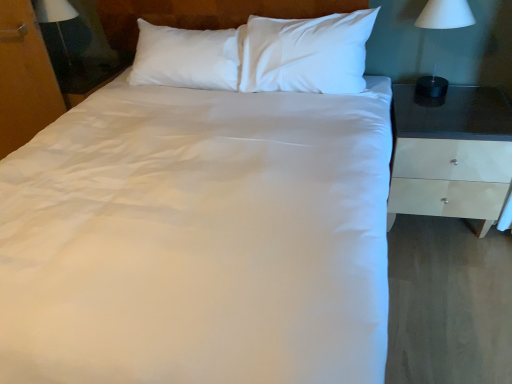
How much space does matte black lampshade at left, placed as the second bedside lamp when sorted from right to left, occupy vertically?

19.06 inches.

In the scene shown: Measure the distance between point (44, 11) and camera.

The distance of point (44, 11) from camera is 2.75 meters.

The width and height of the screenshot is (512, 384). Describe the element at coordinates (441, 37) in the screenshot. I see `white matte lamp at right, the 2th bedside lamp from the back` at that location.

In order to face wooden dresser at left, should I rotate leftwards or rightwards?

A 28.581 degree turn to the left will do.

Where is `matte black lampshade at left, the first bedside lamp in the back-to-front sequence`? This screenshot has width=512, height=384. matte black lampshade at left, the first bedside lamp in the back-to-front sequence is located at coordinates (56, 18).

From the image's perspective, which is below, matte black lampshade at left, which ranks as the 1th bedside lamp in left-to-right order, or white matte lamp at right, the 2th bedside lamp from the back?

From the image's view, white matte lamp at right, the 2th bedside lamp from the back, is below.

Does matte black lampshade at left, which ranks as the 1th bedside lamp in left-to-right order, have a greater width compared to white matte lamp at right, the first bedside lamp from the right?

Correct, the width of matte black lampshade at left, which ranks as the 1th bedside lamp in left-to-right order, exceeds that of white matte lamp at right, the first bedside lamp from the right.

Is matte black lampshade at left, the first bedside lamp in the back-to-front sequence, turned away from white matte lamp at right, the 2th bedside lamp from the back?

No.

Considering the relative sizes of white glossy nightstand at right and matte black lampshade at left, placed as the second bedside lamp when sorted from right to left, in the image provided, is white glossy nightstand at right thinner than matte black lampshade at left, placed as the second bedside lamp when sorted from right to left,?

No, white glossy nightstand at right is not thinner than matte black lampshade at left, placed as the second bedside lamp when sorted from right to left.

Is white glossy nightstand at right outside of matte black lampshade at left, which ranks as the 1th bedside lamp in left-to-right order?

Yes, white glossy nightstand at right is not within matte black lampshade at left, which ranks as the 1th bedside lamp in left-to-right order.

This screenshot has width=512, height=384. Identify the location of nightstand located below the matte black lampshade at left, which ranks as the 1th bedside lamp in left-to-right order (from the image's perspective). (451, 154).

From a real-world perspective, is white glossy nightstand at right on top of matte black lampshade at left, placed as the second bedside lamp when sorted from right to left?

No, from a real-world perspective, white glossy nightstand at right is not over matte black lampshade at left, placed as the second bedside lamp when sorted from right to left

Considering the relative positions of white glossy nightstand at right and wooden dresser at left in the image provided, is white glossy nightstand at right to the left of wooden dresser at left from the viewer's perspective?

Incorrect, white glossy nightstand at right is not on the left side of wooden dresser at left.

Can you tell me how much white glossy nightstand at right and wooden dresser at left differ in facing direction?

white glossy nightstand at right and wooden dresser at left are facing 2.45 degrees away from each other.

Considering the relative sizes of white glossy nightstand at right and wooden dresser at left in the image provided, is white glossy nightstand at right shorter than wooden dresser at left?

Indeed, white glossy nightstand at right has a lesser height compared to wooden dresser at left.

Is there a large distance between white glossy nightstand at right and wooden dresser at left?

Yes, white glossy nightstand at right and wooden dresser at left are quite far apart.

Is point (444, 26) positioned in front of point (54, 11)?

Yes, point (444, 26) is closer to viewer.

From the image's perspective, between white matte lamp at right, marked as the 1th bedside lamp in a front-to-back arrangement, and matte black lampshade at left, the first bedside lamp in the back-to-front sequence, who is located below?

From the image's view, white matte lamp at right, marked as the 1th bedside lamp in a front-to-back arrangement, is below.

Does white matte lamp at right, the first bedside lamp from the right, turn towards matte black lampshade at left, the second bedside lamp from the front?

No, white matte lamp at right, the first bedside lamp from the right, is not turned towards matte black lampshade at left, the second bedside lamp from the front.

Is white matte lamp at right, which appears as the second bedside lamp when viewed from the left, thinner than white glossy nightstand at right?

Correct, the width of white matte lamp at right, which appears as the second bedside lamp when viewed from the left, is less than that of white glossy nightstand at right.

From the image's perspective, is white matte lamp at right, the 2th bedside lamp from the back, located above white glossy nightstand at right?

Correct, white matte lamp at right, the 2th bedside lamp from the back, appears higher than white glossy nightstand at right in the image.

Is white matte lamp at right, the first bedside lamp from the right, facing towards white glossy nightstand at right?

No, white matte lamp at right, the first bedside lamp from the right, is not oriented towards white glossy nightstand at right.

Is matte black lampshade at left, which ranks as the 1th bedside lamp in left-to-right order, not close to white glossy nightstand at right?

Yes, matte black lampshade at left, which ranks as the 1th bedside lamp in left-to-right order, is far from white glossy nightstand at right.

Is matte black lampshade at left, the second bedside lamp from the front, thinner than white glossy nightstand at right?

Yes.

Which object is positioned more to the right, matte black lampshade at left, the first bedside lamp in the back-to-front sequence, or white glossy nightstand at right?

white glossy nightstand at right.

Are wooden dresser at left and white glossy nightstand at right located far from each other?

Yes.

Is wooden dresser at left inside the boundaries of white glossy nightstand at right, or outside?

wooden dresser at left lies outside white glossy nightstand at right.

Is wooden dresser at left oriented towards white glossy nightstand at right?

No, wooden dresser at left is not facing towards white glossy nightstand at right.

Can you confirm if wooden dresser at left is positioned to the right of white glossy nightstand at right?

In fact, wooden dresser at left is to the left of white glossy nightstand at right.

The image size is (512, 384). Find the location of `bedside lamp behind the white matte lamp at right, which appears as the second bedside lamp when viewed from the left`. bedside lamp behind the white matte lamp at right, which appears as the second bedside lamp when viewed from the left is located at coordinates (56, 18).

Where is `nightstand in front of the matte black lampshade at left, the second bedside lamp from the front`? The height and width of the screenshot is (384, 512). nightstand in front of the matte black lampshade at left, the second bedside lamp from the front is located at coordinates (451, 154).

When comparing their distances from matte black lampshade at left, the first bedside lamp in the back-to-front sequence, does wooden dresser at left or white matte lamp at right, marked as the 1th bedside lamp in a front-to-back arrangement, seem closer?

wooden dresser at left lies closer to matte black lampshade at left, the first bedside lamp in the back-to-front sequence, than the other object.

Consider the image. Considering their positions, is matte black lampshade at left, placed as the second bedside lamp when sorted from right to left, positioned further to wooden dresser at left than white glossy nightstand at right?

white glossy nightstand at right is further to wooden dresser at left.

Based on their spatial positions, is white matte lamp at right, which appears as the second bedside lamp when viewed from the left, or wooden dresser at left closer to matte black lampshade at left, the second bedside lamp from the front?

wooden dresser at left is positioned closer to the anchor matte black lampshade at left, the second bedside lamp from the front.

Which object lies nearer to the anchor point white glossy nightstand at right, white matte lamp at right, which appears as the second bedside lamp when viewed from the left, or matte black lampshade at left, the second bedside lamp from the front?

white matte lamp at right, which appears as the second bedside lamp when viewed from the left, is positioned closer to the anchor white glossy nightstand at right.

Based on their spatial positions, is matte black lampshade at left, which ranks as the 1th bedside lamp in left-to-right order, or white matte lamp at right, which appears as the second bedside lamp when viewed from the left, further from white glossy nightstand at right?

matte black lampshade at left, which ranks as the 1th bedside lamp in left-to-right order, is positioned further to the anchor white glossy nightstand at right.

Looking at the image, which one is located further to wooden dresser at left, white glossy nightstand at right or white matte lamp at right, the 2th bedside lamp from the back?

white glossy nightstand at right is further to wooden dresser at left.

Based on their spatial positions, is white glossy nightstand at right or wooden dresser at left closer to white matte lamp at right, which appears as the second bedside lamp when viewed from the left?

white glossy nightstand at right lies closer to white matte lamp at right, which appears as the second bedside lamp when viewed from the left, than the other object.

From the image, which object appears to be farther from white glossy nightstand at right, matte black lampshade at left, the first bedside lamp in the back-to-front sequence, or wooden dresser at left?

Based on the image, matte black lampshade at left, the first bedside lamp in the back-to-front sequence, appears to be further to white glossy nightstand at right.

Locate an element on the screen. The width and height of the screenshot is (512, 384). bedside lamp between matte black lampshade at left, which ranks as the 1th bedside lamp in left-to-right order, and white glossy nightstand at right is located at coordinates pyautogui.click(x=441, y=37).

This screenshot has height=384, width=512. Find the location of `bedside lamp situated between wooden dresser at left and white matte lamp at right, the first bedside lamp from the right, from left to right`. bedside lamp situated between wooden dresser at left and white matte lamp at right, the first bedside lamp from the right, from left to right is located at coordinates (56, 18).